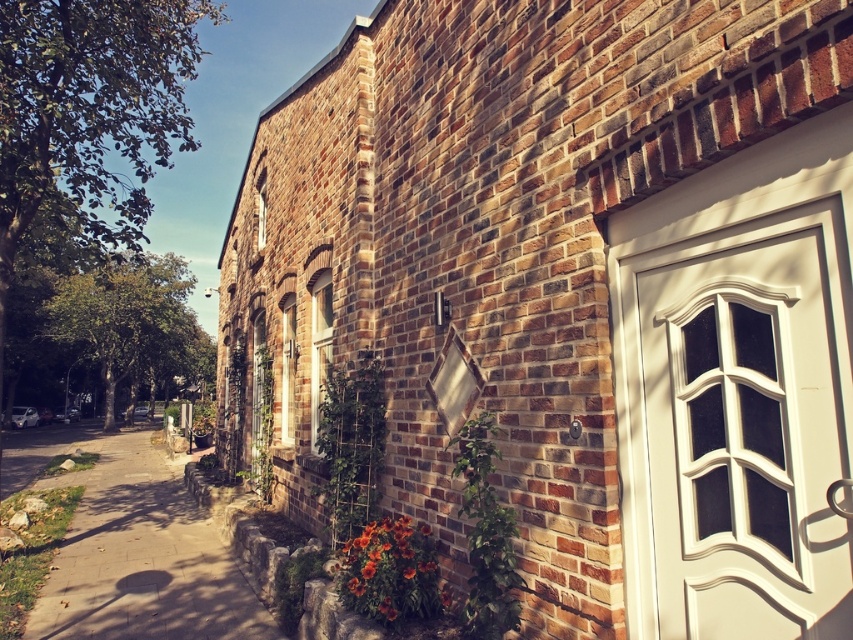
Is gray concrete sidewalk at lower left taller than vibrant orange petals at lower center?

Indeed, gray concrete sidewalk at lower left has a greater height compared to vibrant orange petals at lower center.

Which is in front, point (160, 500) or point (422, 612)?

Point (422, 612) is more forward.

You are a GUI agent. You are given a task and a screenshot of the screen. Output one action in this format:
    pyautogui.click(x=<x>, y=<y>)
    Task: Click on the gray concrete sidewalk at lower left
    
    Given the screenshot: What is the action you would take?
    pyautogui.click(x=137, y=550)

Where is `gray concrete sidewalk at lower left`? The image size is (853, 640). gray concrete sidewalk at lower left is located at coordinates (137, 550).